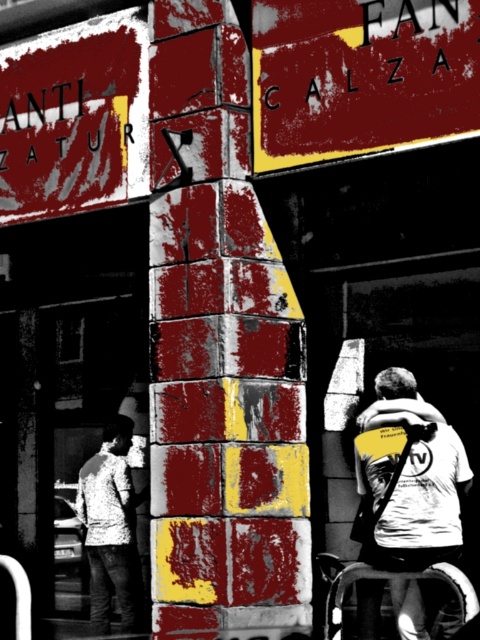
Question: Which is nearer to the marbled stone pillar at center?

Choices:
 (A) white matte t-shirt at lower right
 (B) flannel shirt at lower left

Answer: (A)

Question: Can you confirm if marbled stone pillar at center is smaller than white plastic cart at lower right?

Choices:
 (A) yes
 (B) no

Answer: (B)

Question: Is matte yellow sign at upper center wider than white plastic cart at lower right?

Choices:
 (A) yes
 (B) no

Answer: (A)

Question: Which point appears farthest from the camera in this image?

Choices:
 (A) (222, 90)
 (B) (359, 74)
 (C) (342, 589)

Answer: (A)

Question: Which point is closer to the camera taking this photo?

Choices:
 (A) (305, 161)
 (B) (351, 570)
 (C) (96, 486)

Answer: (B)

Question: Is marbled stone pillar at center in front of white plastic cart at lower right?

Choices:
 (A) no
 (B) yes

Answer: (A)